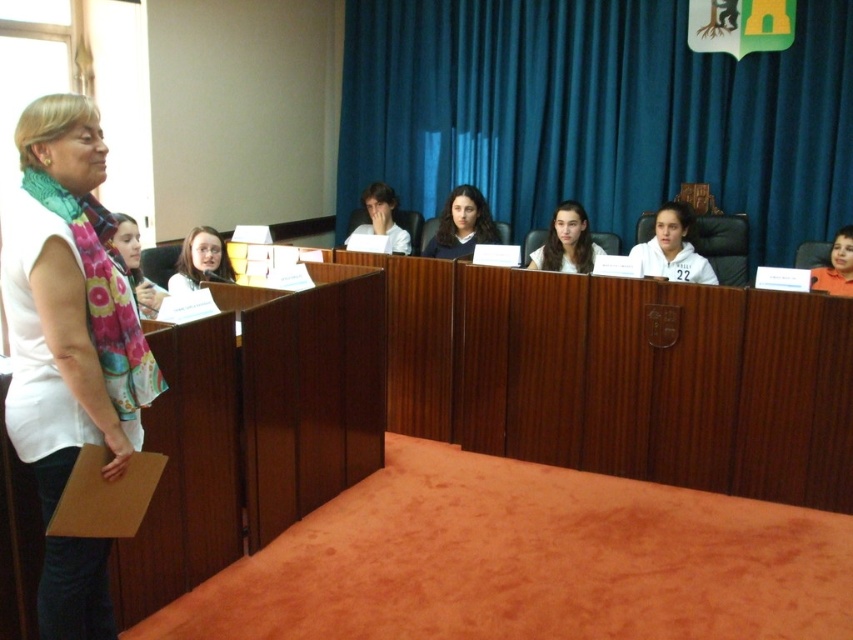
Image resolution: width=853 pixels, height=640 pixels. What do you see at coordinates (566, 241) in the screenshot? I see `smooth brown hair at center` at bounding box center [566, 241].

Between point (585, 264) and point (163, 291), which one is positioned in front?

Positioned in front is point (163, 291).

Find the location of a particular element. The image size is (853, 640). smooth brown hair at center is located at coordinates (566, 241).

Can you confirm if white matte shirt at center is positioned above floral fabric scarf at left?

Yes.

Can you confirm if white matte shirt at center is positioned below floral fabric scarf at left?

No.

At what (x,y) coordinates should I click in order to perform the action: click on white matte shirt at center. Please return your answer as a coordinate pair (x, y). Image resolution: width=853 pixels, height=640 pixels. Looking at the image, I should click on (672, 248).

Find the location of a particular element. The image size is (853, 640). white matte shirt at center is located at coordinates (672, 248).

Is white fabric scarf at left taller than matte white shirt at center?

Yes.

Does white fabric scarf at left have a greater width compared to matte white shirt at center?

Incorrect, white fabric scarf at left's width does not surpass matte white shirt at center's.

Based on the photo, measure the distance between white fabric scarf at left and camera.

white fabric scarf at left and camera are 5.71 feet apart.

In order to click on white fabric scarf at left in this screenshot , I will do `click(68, 305)`.